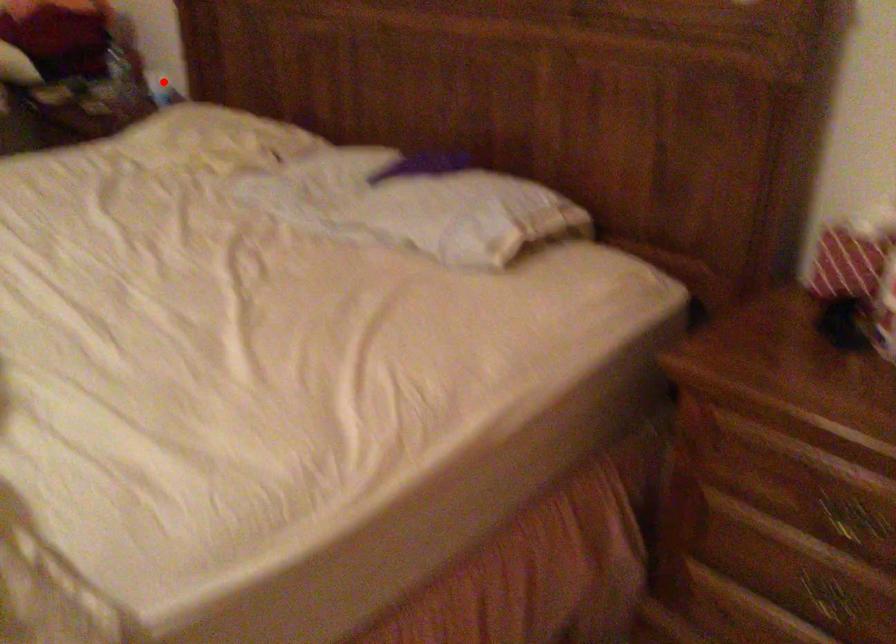
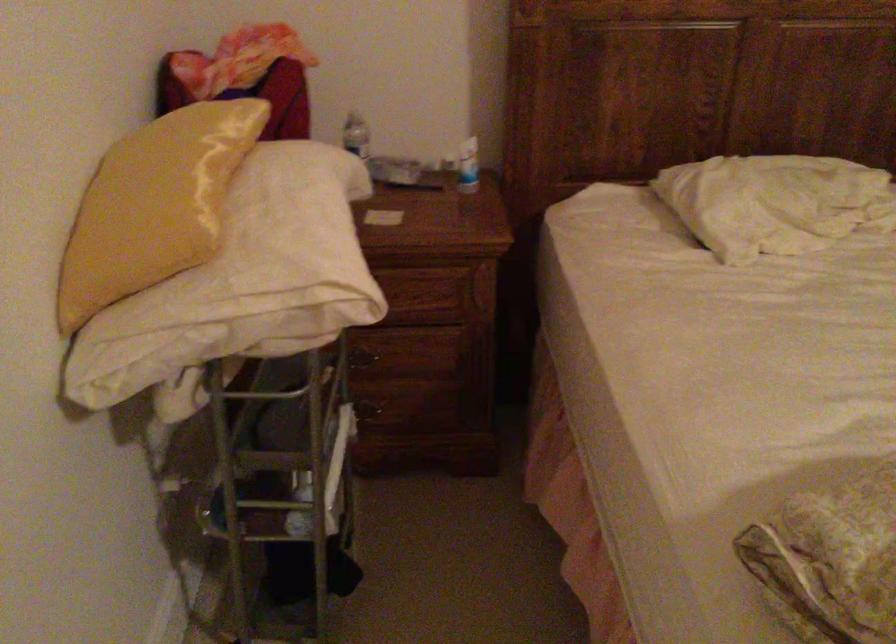
Question: I am providing you with two images of the same scene from different viewpoints. In image1, a red point is highlighted. Considering the same 3D point in image2, which of the following is correct?

Choices:
 (A) It is closer
 (B) It is farther

Answer: (A)